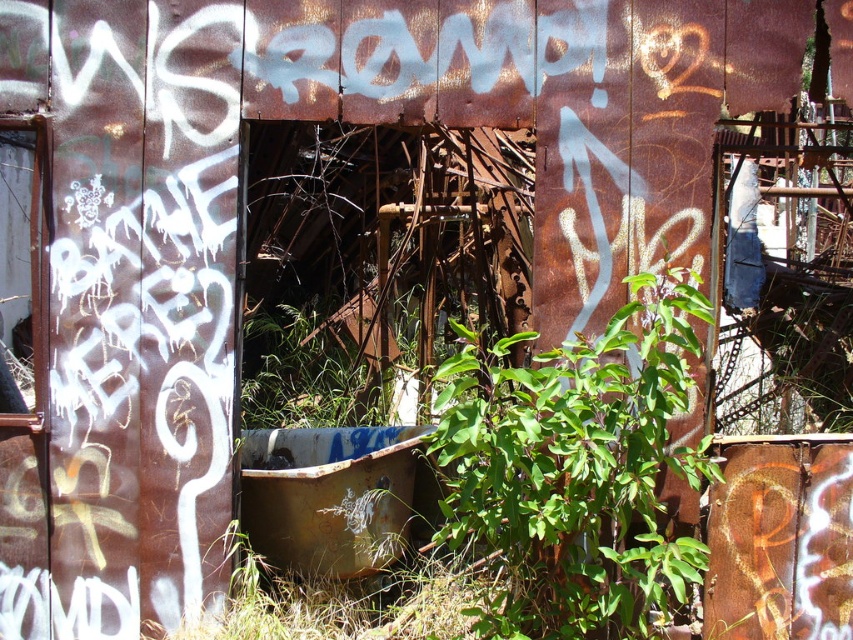
Question: Is green leafy plant at center thinner than rusty metal tub at center?

Choices:
 (A) no
 (B) yes

Answer: (A)

Question: Which point is farther from the camera taking this photo?

Choices:
 (A) (323, 550)
 (B) (563, 620)

Answer: (A)

Question: Is green leafy plant at center in front of rusty metal tub at center?

Choices:
 (A) yes
 (B) no

Answer: (A)

Question: Can you confirm if green leafy plant at center is smaller than rusty metal tub at center?

Choices:
 (A) no
 (B) yes

Answer: (A)

Question: Which of the following is the farthest from the observer?

Choices:
 (A) (511, 616)
 (B) (244, 467)

Answer: (B)